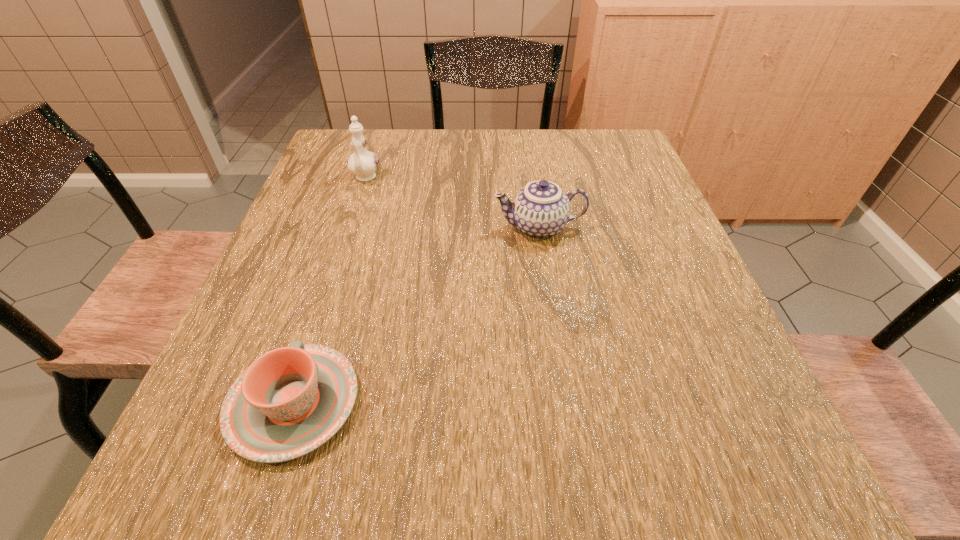
Identify the location of the tallest chinaware. The image size is (960, 540). (363, 163).

Image resolution: width=960 pixels, height=540 pixels. Identify the location of the tallest object. (363, 163).

This screenshot has width=960, height=540. What are the coordinates of `the second nearest object` in the screenshot? It's located at (540, 210).

Locate an element on the screen. This screenshot has height=540, width=960. the rightmost chinaware is located at coordinates pyautogui.click(x=540, y=210).

Where is `the nearest chinaware`? Image resolution: width=960 pixels, height=540 pixels. the nearest chinaware is located at coordinates (290, 401).

Image resolution: width=960 pixels, height=540 pixels. I want to click on the nearest object, so click(x=290, y=401).

The height and width of the screenshot is (540, 960). In order to click on vacant space located 0.270m at the spout of the tallest chinaware in this screenshot , I will do `click(337, 263)`.

You are a GUI agent. You are given a task and a screenshot of the screen. Output one action in this format:
    pyautogui.click(x=<x>, y=<y>)
    Task: Click on the vacant space located 0.150m from the spout of the rightmost chinaware
    The width and height of the screenshot is (960, 540).
    Given the screenshot: What is the action you would take?
    pyautogui.click(x=427, y=227)

The width and height of the screenshot is (960, 540). I want to click on vacant region located from the spout of the rightmost chinaware, so [338, 227].

Where is `blank space located from the spout of the rightmost chinaware`? The height and width of the screenshot is (540, 960). blank space located from the spout of the rightmost chinaware is located at coordinates (422, 227).